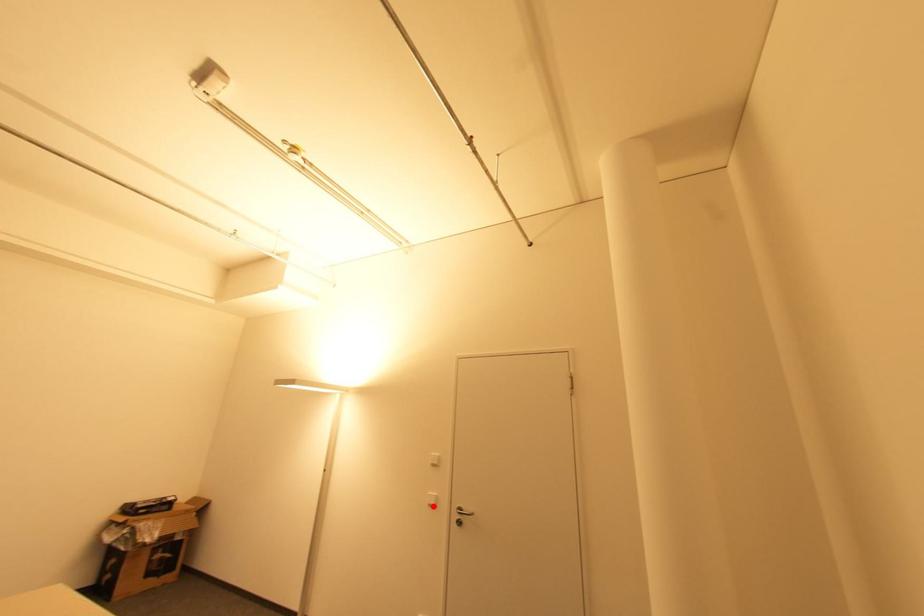
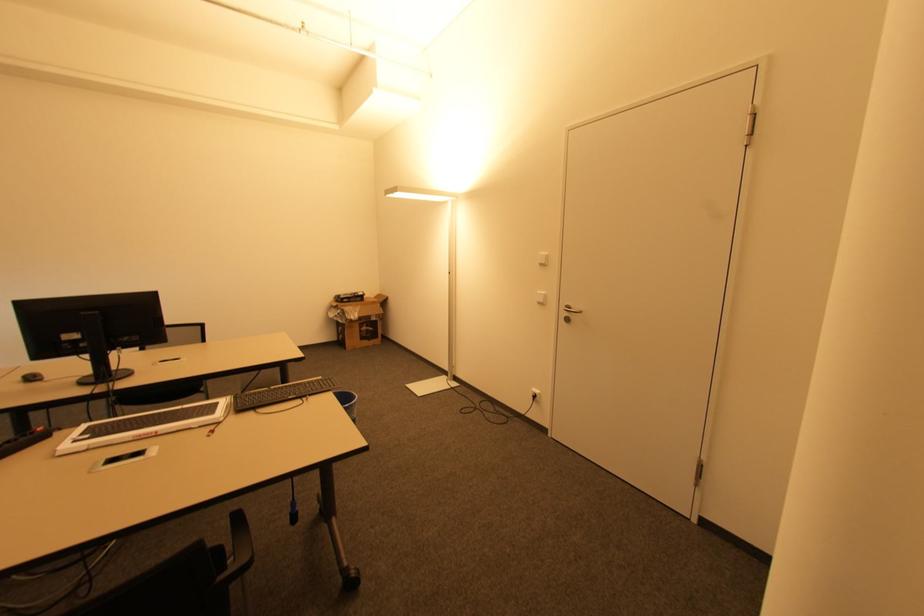
Locate, in the second image, the point that corresponds to the highlighted location in the first image.

(541, 302)